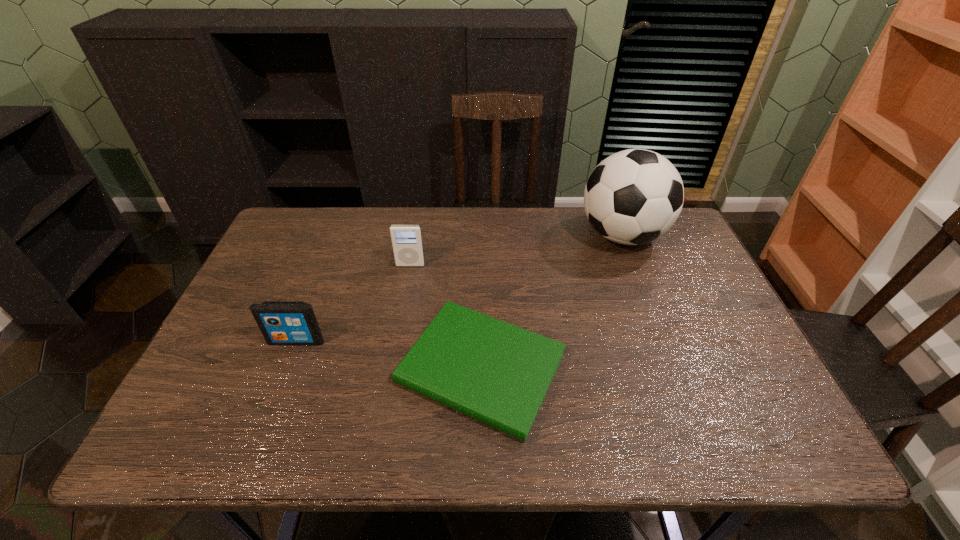
Where is `soccer ball`? soccer ball is located at coordinates (634, 196).

Locate an element on the screen. the tallest object is located at coordinates (634, 196).

Identify the location of the right iPod. Image resolution: width=960 pixels, height=540 pixels. (406, 239).

Locate an element on the screen. The image size is (960, 540). the nearer iPod is located at coordinates (281, 322).

Where is `the leftmost object`? This screenshot has width=960, height=540. the leftmost object is located at coordinates (281, 322).

Identify the location of the shortest object. Image resolution: width=960 pixels, height=540 pixels. (497, 373).

Where is `vacant space located 0.060m on the front of the tallest object`? Image resolution: width=960 pixels, height=540 pixels. vacant space located 0.060m on the front of the tallest object is located at coordinates (638, 279).

Locate an element on the screen. The width and height of the screenshot is (960, 540). blank space located on the front-facing side of the farther iPod is located at coordinates (406, 291).

This screenshot has width=960, height=540. I want to click on free spot located on the front screen of the nearer iPod, so click(x=259, y=439).

Find the location of a particular element. The image size is (960, 540). vacant space situated on the back of the shortest object is located at coordinates (481, 231).